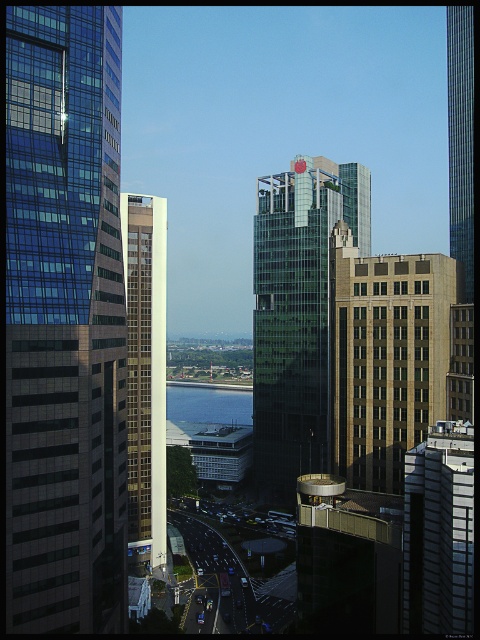
What do you see at coordinates (439, 531) in the screenshot? Image resolution: width=480 pixels, height=640 pixels. I see `white glossy building at center-right` at bounding box center [439, 531].

Is white glossy building at center-right closer to the viewer compared to blue glass water at center?

That is True.

This screenshot has height=640, width=480. I want to click on white glossy building at center-right, so click(439, 531).

Is point (113, 252) closer to camera compared to point (296, 170)?

That is True.

Can you confirm if glassy reflective skyscraper at left is positioned to the left of green glass building at center?

Correct, you'll find glassy reflective skyscraper at left to the left of green glass building at center.

Which is in front, point (82, 179) or point (275, 499)?

Positioned in front is point (82, 179).

This screenshot has height=640, width=480. In order to click on glassy reflective skyscraper at left in this screenshot , I will do tap(64, 323).

Is brown brick building at center smaller than glassy skyscraper at right?

Yes, brown brick building at center is smaller than glassy skyscraper at right.

Which is below, brown brick building at center or glassy skyscraper at right?

Positioned lower is brown brick building at center.

Which is in front, point (375, 419) or point (464, 145)?

Point (375, 419) is more forward.

Where is `brown brick building at center`? The height and width of the screenshot is (640, 480). brown brick building at center is located at coordinates (386, 356).